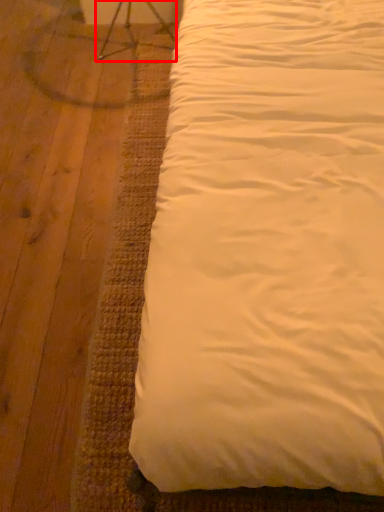
Question: Where is swivel chair (annotated by the red box) located in relation to bed in the image?

Choices:
 (A) right
 (B) left

Answer: (B)